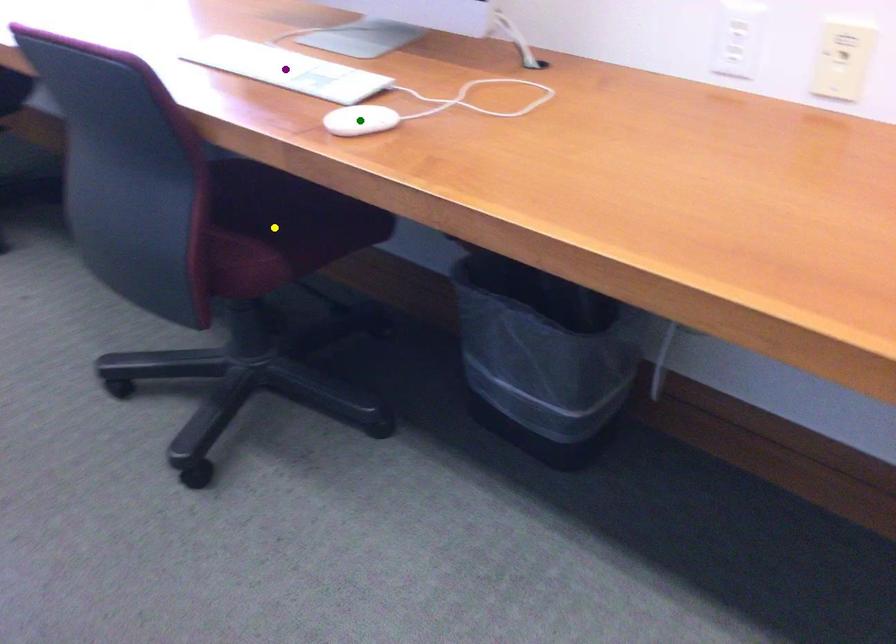
Order these from farthest to nearest:
yellow point | purple point | green point

yellow point
purple point
green point